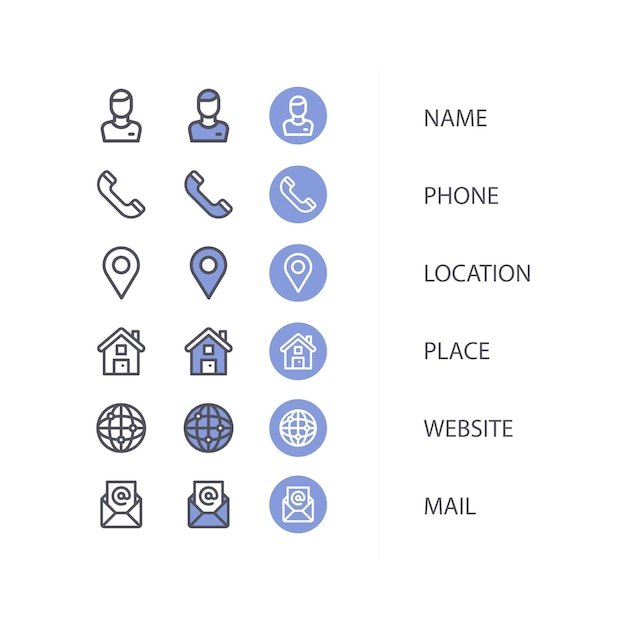
Where is `phone`? The width and height of the screenshot is (626, 626). phone is located at coordinates (459, 196), (302, 186), (203, 193), (111, 193).